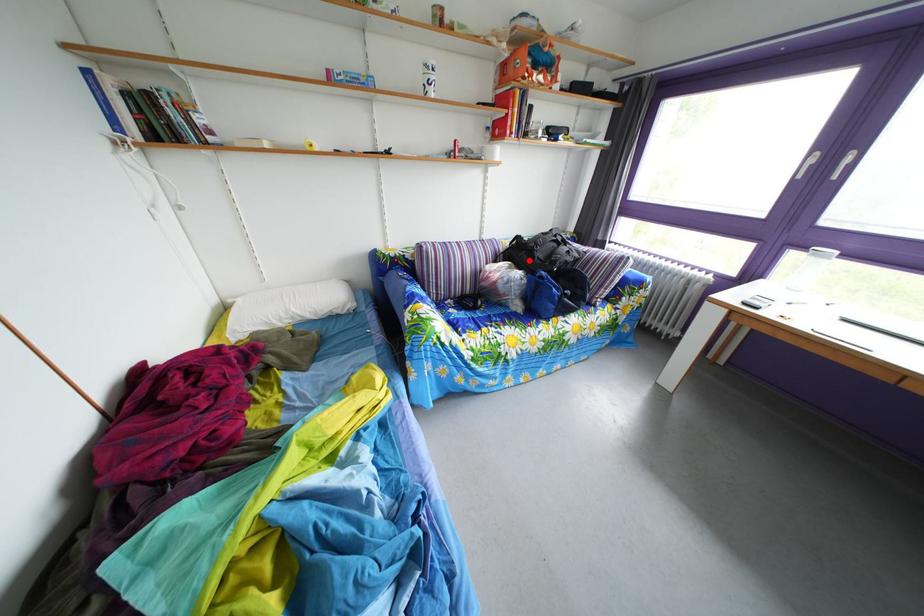
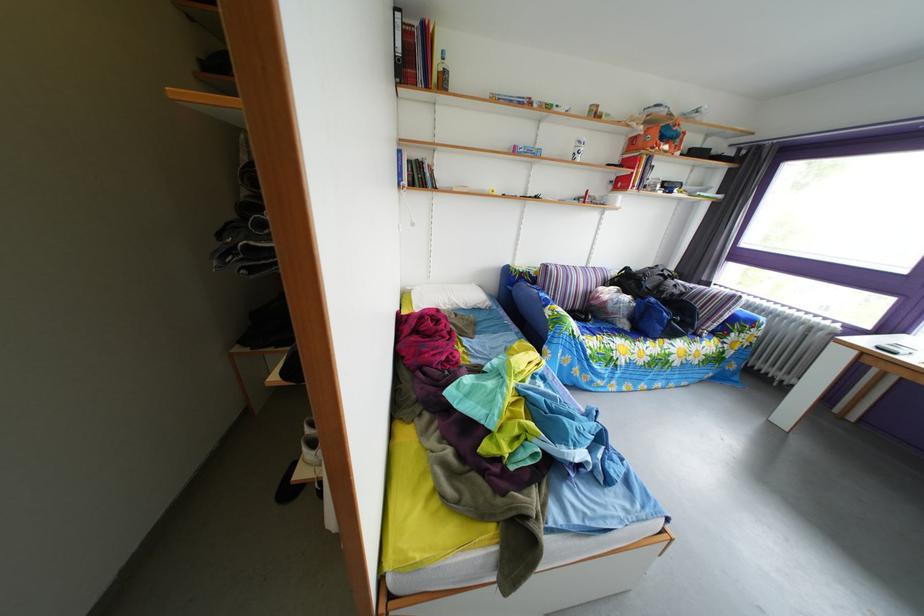
Find the pixel in the second image that matches the highlighted location in the first image.

(638, 289)